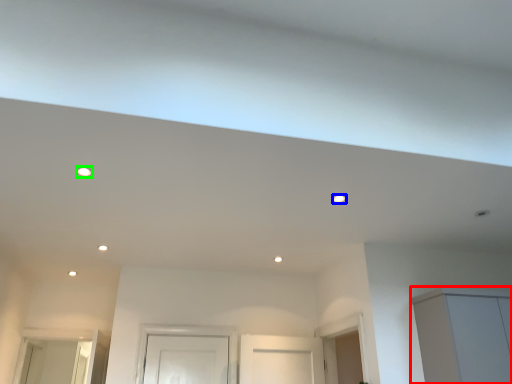
Question: Considering the real-world distances, which object is farthest from cabinetry (highlighted by a red box)? lighting (highlighted by a blue box) or lighting (highlighted by a green box)?

Choices:
 (A) lighting
 (B) lighting

Answer: (B)